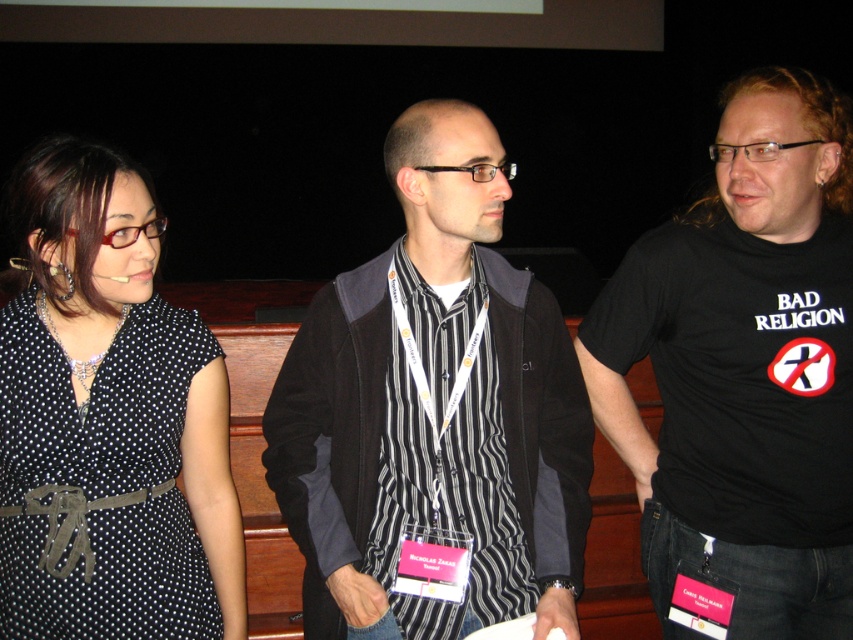
Consider the image. You are at a conference and want to take a photo of the polka dot fabric dress at left and the black striped shirt at center. Which one should you focus on first if you want to capture both in the same frame without moving the camera?

The polka dot fabric dress at left is much taller than the black striped shirt at center, so you should focus on the polka dot fabric dress at left first to ensure it fits within the frame.